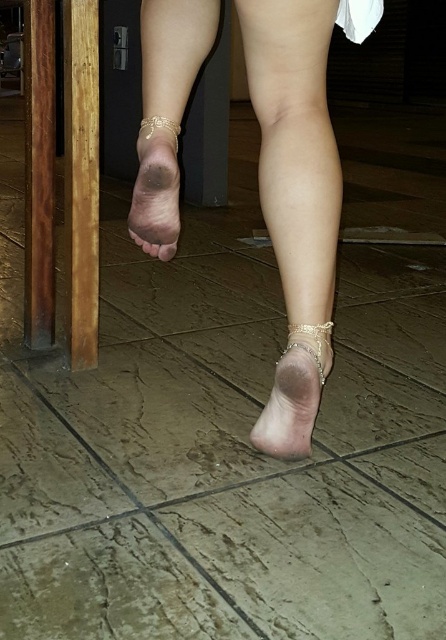
Question: Estimate the real-world distances between objects in this image. Which object is farther from the matte gold anklet at center?

Choices:
 (A) dry skin at center
 (B) pink matte toe at center
 (C) gold metallic sandal at lower center
 (D) smooth skin leg at center

Answer: (C)

Question: Can you confirm if dry skin at center is thinner than pink matte toe at center?

Choices:
 (A) yes
 (B) no

Answer: (B)

Question: Which of the following is the closest to the observer?

Choices:
 (A) (300, 448)
 (B) (165, 241)
 (C) (156, 131)
 (D) (169, 195)

Answer: (C)

Question: Does dry skin at center appear on the left side of pink matte toe at center?

Choices:
 (A) no
 (B) yes

Answer: (B)

Question: Which point is farther to the camera?

Choices:
 (A) smooth skin leg at center
 (B) matte gold anklet at center

Answer: (B)

Question: Does matte gold anklet at center appear on the left side of pink matte toe at center?

Choices:
 (A) no
 (B) yes

Answer: (A)